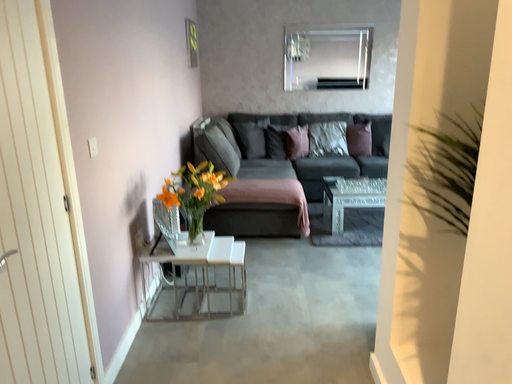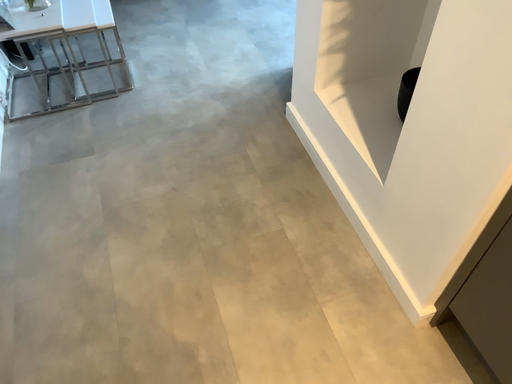
Question: Which way did the camera rotate in the video?

Choices:
 (A) rotated left
 (B) rotated right

Answer: (B)